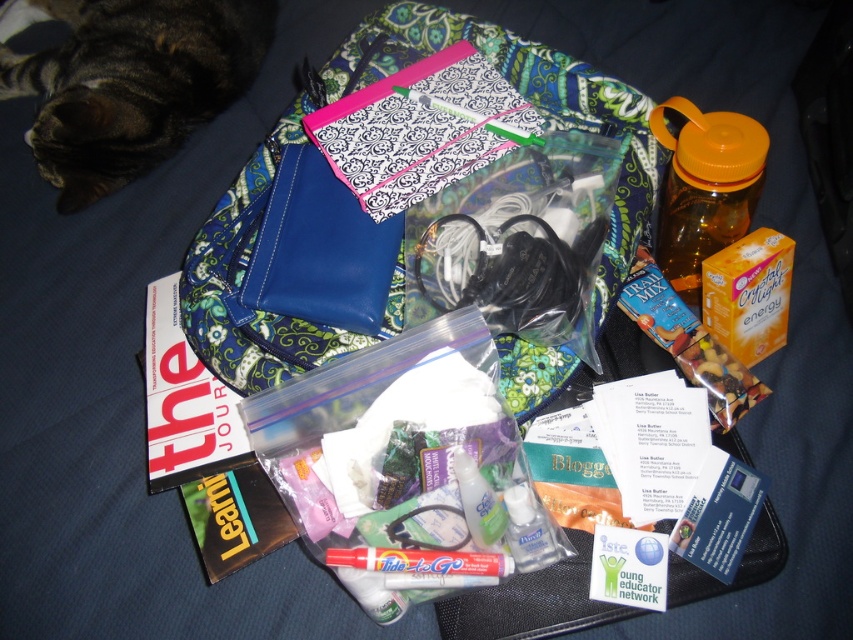
Does matte blue pouch at center have a greater width compared to clear plastic hand sanitizer at center?

Indeed, matte blue pouch at center has a greater width compared to clear plastic hand sanitizer at center.

Can you confirm if matte blue pouch at center is positioned above clear plastic hand sanitizer at center?

Correct, matte blue pouch at center is located above clear plastic hand sanitizer at center.

Which is behind, point (265, 353) or point (514, 529)?

Positioned behind is point (265, 353).

This screenshot has width=853, height=640. In order to click on matte blue pouch at center in this screenshot , I will do `click(399, 243)`.

Which is more to the right, clear plastic hand sanitizer at center or clear gel at center?

Positioned to the right is clear plastic hand sanitizer at center.

Who is taller, clear plastic hand sanitizer at center or clear gel at center?

clear gel at center

Who is more distant from viewer, (523,508) or (480,481)?

Positioned behind is point (523,508).

Find the location of a particular element. The image size is (853, 640). clear plastic hand sanitizer at center is located at coordinates (531, 531).

Who is lower down, matte blue pouch at center or orange plastic bottle at upper right?

orange plastic bottle at upper right

Which is behind, point (409, 45) or point (695, 301)?

Point (409, 45)

Between point (378, 38) and point (691, 124), which one is positioned in front?

Point (691, 124)

Image resolution: width=853 pixels, height=640 pixels. Identify the location of matte blue pouch at center. (399, 243).